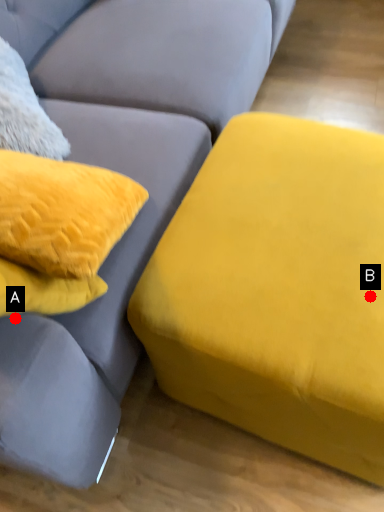
Question: Two points are circled on the image, labeled by A and B beside each circle. Which point is closer to the camera?

Choices:
 (A) A is closer
 (B) B is closer

Answer: (A)